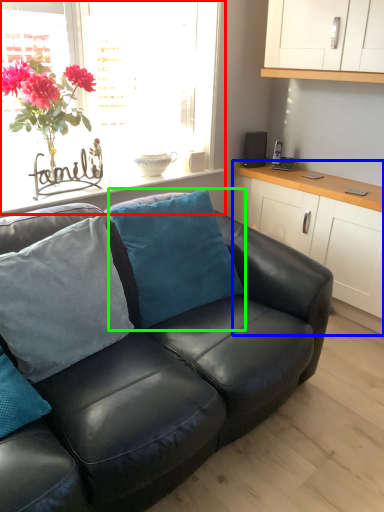
Question: Based on their relative distances, which object is nearer to window (highlighted by a red box)? Choose from cabinetry (highlighted by a blue box) and pillow (highlighted by a green box).

Choices:
 (A) cabinetry
 (B) pillow

Answer: (B)